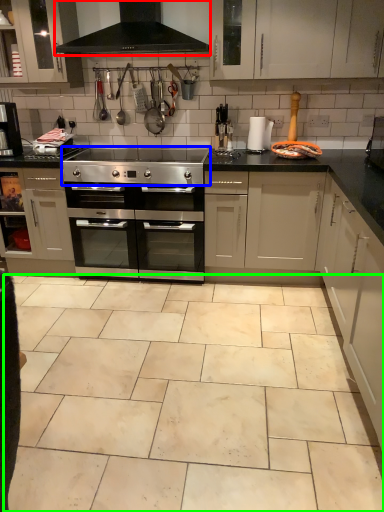
Question: Which object is positioned farthest from exhaust hood (highlighted by a red box)? Select from gas stove (highlighted by a blue box) and ceramic tile (highlighted by a green box).

Choices:
 (A) gas stove
 (B) ceramic tile

Answer: (B)